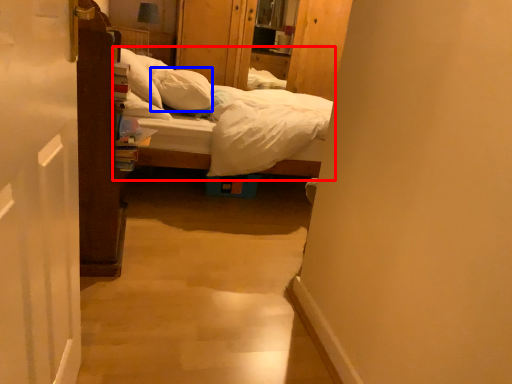
Question: Which of the following is the closest to the observer, bed (highlighted by a red box) or pillow (highlighted by a blue box)?

Choices:
 (A) bed
 (B) pillow

Answer: (A)